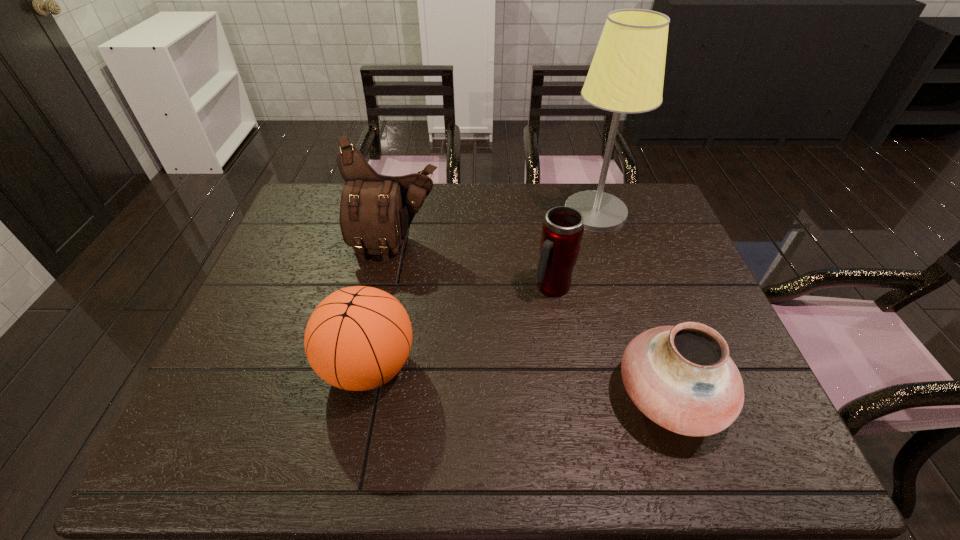
In the image, there is a desktop. Where is `vacant region at the far left corner`? The image size is (960, 540). vacant region at the far left corner is located at coordinates (305, 223).

Locate an element on the screen. The image size is (960, 540). free space at the near right corner is located at coordinates (732, 438).

The height and width of the screenshot is (540, 960). I want to click on empty space between the shortest object and the second tallest object, so click(533, 320).

Where is `unoccupied position between the tallest object and the basketball`? unoccupied position between the tallest object and the basketball is located at coordinates (482, 289).

Locate an element on the screen. free area in between the tallest object and the basketball is located at coordinates (482, 289).

At what (x,y) coordinates should I click in order to perform the action: click on empty space between the thermos bottle and the second tallest object. Please return your answer as a coordinate pair (x, y). The image size is (960, 540). Looking at the image, I should click on (474, 266).

Where is `vacant region between the fourth shortest object and the shortest object`? The image size is (960, 540). vacant region between the fourth shortest object and the shortest object is located at coordinates pos(533,320).

The image size is (960, 540). In order to click on vacant space that's between the shoulder bag and the tallest object in this screenshot , I will do `click(495, 228)`.

This screenshot has width=960, height=540. In order to click on vacant region between the basketball and the tallest object in this screenshot , I will do `click(482, 289)`.

The height and width of the screenshot is (540, 960). Identify the location of the second closest object to the shortest object. (626, 75).